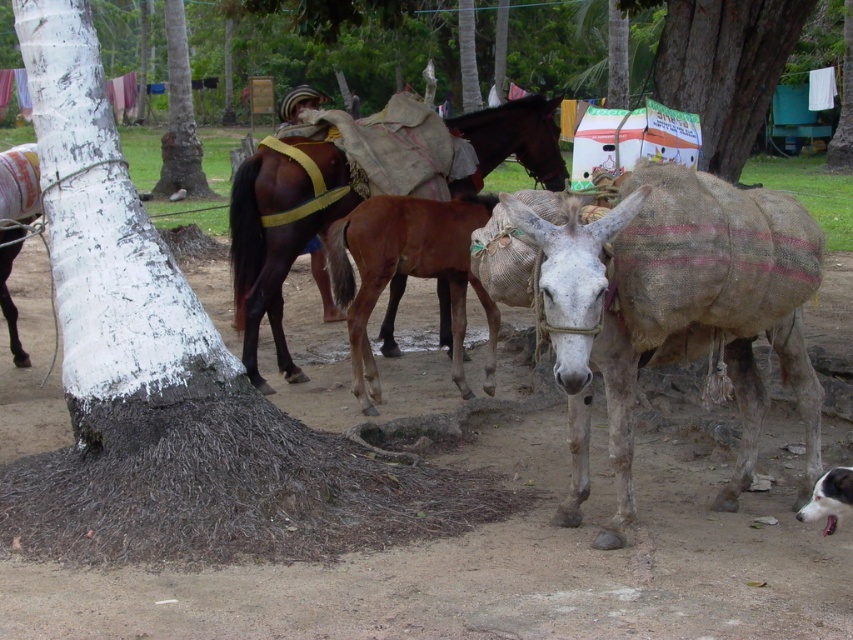
Question: Is white painted bark at center left to the right of white fur dog at lower right from the viewer's perspective?

Choices:
 (A) no
 (B) yes

Answer: (A)

Question: Among these points, which one is nearest to the camera?

Choices:
 (A) (50, 12)
 (B) (804, 13)
 (C) (612, 384)
 (D) (200, 192)

Answer: (C)

Question: In this image, where is white bark tree at upper left located relative to white fur dog at lower right?

Choices:
 (A) right
 (B) left

Answer: (B)

Question: Does smooth bark tree at upper center have a greater width compared to white bark tree at upper left?

Choices:
 (A) no
 (B) yes

Answer: (B)

Question: Which of the following is the farthest from the observer?

Choices:
 (A) white bark tree at upper left
 (B) brown matte horse at center
 (C) smooth bark tree at upper center
 (D) grayish-white burlap sack at center

Answer: (A)

Question: Estimate the real-world distances between objects in this image. Which object is closer to the grayish-white burlap sack at center?

Choices:
 (A) smooth bark tree at upper center
 (B) white bark tree at upper left
 (C) white painted bark at center left

Answer: (C)